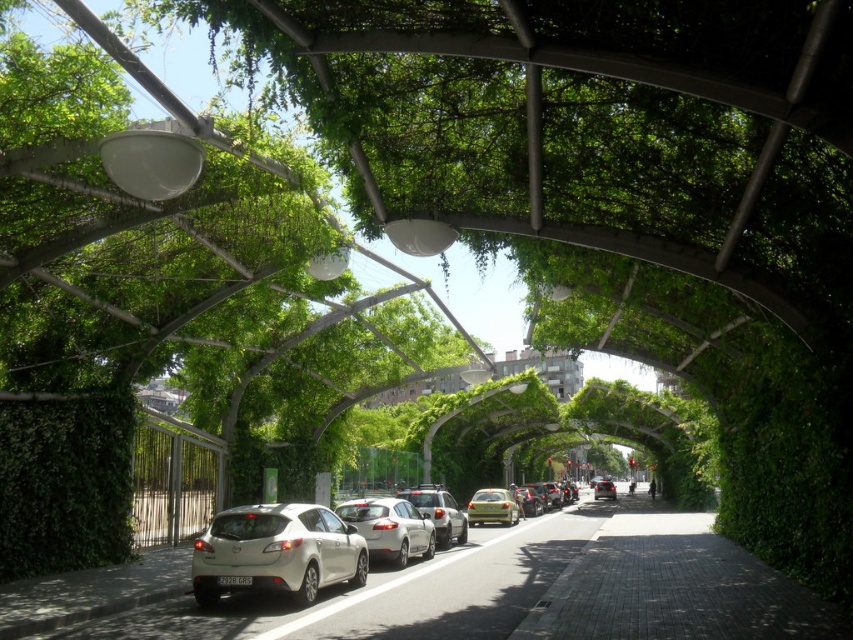
You are a delivery person driving a truck that is 2 meters wide. You need to pass through the street where there are two cars parked at the center, a white matte car at center and a matte silver sedan at center. Can your truck fit between them without touching either car?

The white matte car at center is thinner than the matte silver sedan at center. However, the exact width between them isn not provided. Without knowing the distance between the cars or the total available space, it is impossible to determine if the truck can fit. Please check the spacing between the cars first.

You are standing at the viewpoint of the image and want to reach the point at coordinates (437, 490). If your walking speed is 1.5 meters per second, how many seconds will it take you to reach that point?

The distance between you and the point at coordinates (437, 490) is 32.19 meters. At a walking speed of 1.5 meters per second, it will take approximately 21.46 seconds to reach the point.

You are a delivery driver who needs to park your vehicle next to the satin white hatchback at center. There is a green leafy hedge at left blocking the path. Can you drive around it on the right side?

The green leafy hedge at left is positioned on the left side of the satin white hatchback at center, so you can drive around it on the right side.